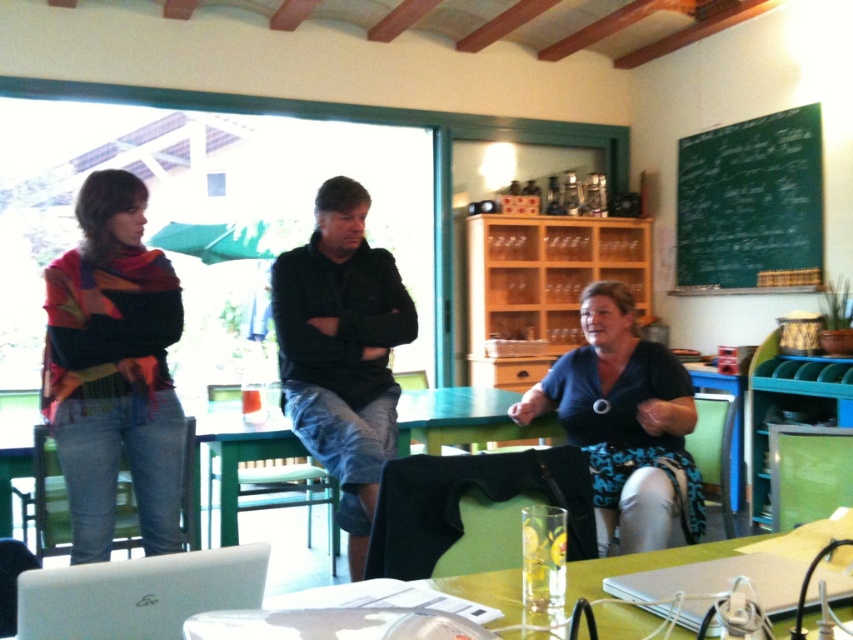
Consider the image. You are sitting at the table and want to write a note on the green chalkboard at upper right. To reach it, you need to move the white matte laptop at lower left. Is the chalkboard to the right or left of the laptop?

The green chalkboard at upper right is positioned on the right side of the white matte laptop at lower left, so it is to the right of the laptop.

You are trying to decide whether to place a new mug on the table without blocking the laptop. Considering the space between the multicolored scarf at left and the white plastic laptop at lower center, can the mug be placed there?

The multicolored scarf at left is taller than the white plastic laptop at lower center, so placing the mug between them might be possible, but ensure there is enough space between the scarf and the laptop to avoid blocking the laptop.

You are trying to decide where to place a new decorative item on the table. The black cotton shirt at center and the white matte laptop at lower left are already there. Which object takes up more horizontal space on the table?

The black cotton shirt at center takes up more horizontal space on the table because its width is larger than that of the white matte laptop at lower left.